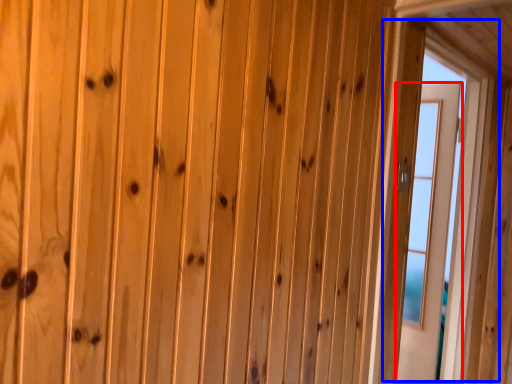
Question: Which point is closer to the camera, door (highlighted by a red box) or window (highlighted by a blue box)?

Choices:
 (A) door
 (B) window

Answer: (B)